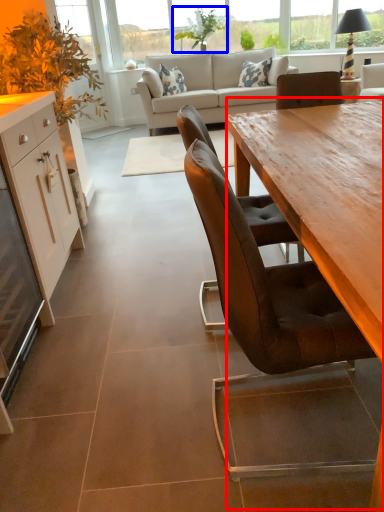
Question: Which object appears closest to the camera in this image, table (highlighted by a red box) or plant (highlighted by a blue box)?

Choices:
 (A) table
 (B) plant

Answer: (A)